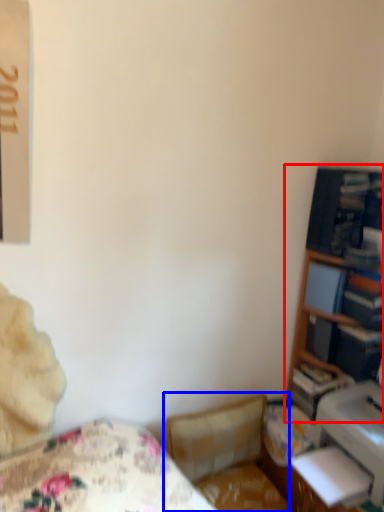
Question: Which object appears farthest to the camera in this image, bookshelf (highlighted by a red box) or swivel chair (highlighted by a blue box)?

Choices:
 (A) bookshelf
 (B) swivel chair

Answer: (A)